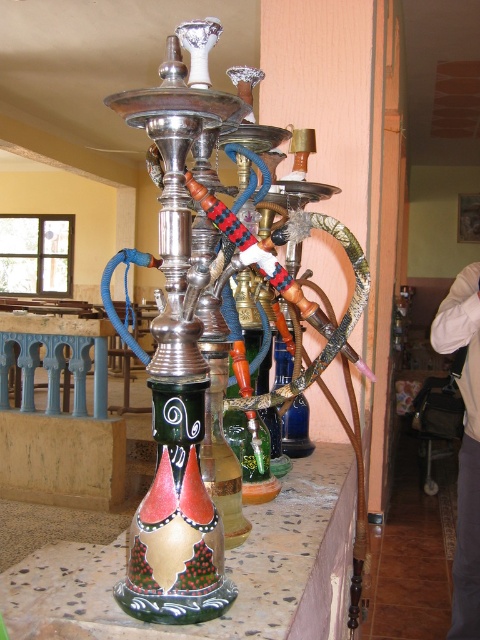
Where is `white fabric shirt at upper right`? Image resolution: width=480 pixels, height=640 pixels. white fabric shirt at upper right is located at coordinates [465, 444].

Is white fabric shirt at upper right above blue painted wood table at lower left?

Incorrect, white fabric shirt at upper right is not positioned above blue painted wood table at lower left.

Between point (459, 602) and point (50, 408), which one is positioned in front?

Point (459, 602) is in front.

Locate an element on the screen. This screenshot has width=480, height=640. white fabric shirt at upper right is located at coordinates (465, 444).

Does painted ceramic hookah at center appear under painted ceramic vase at center?

Indeed, painted ceramic hookah at center is positioned under painted ceramic vase at center.

Between point (36, 625) and point (163, 614), which one is positioned behind?

The point (36, 625) is more distant.

Is point (78, 580) more distant than point (160, 612)?

That is True.

This screenshot has height=640, width=480. I want to click on painted ceramic hookah at center, so click(226, 570).

Is point (153, 403) less distant than point (95, 355)?

Yes, point (153, 403) is in front of point (95, 355).

Does painted ceramic vase at center lie in front of blue painted wood table at lower left?

Yes, painted ceramic vase at center is closer to the viewer.

Does point (173, 442) lie behind point (84, 333)?

No, it is not.

This screenshot has height=640, width=480. Identify the location of painted ceramic vase at center. (176, 522).